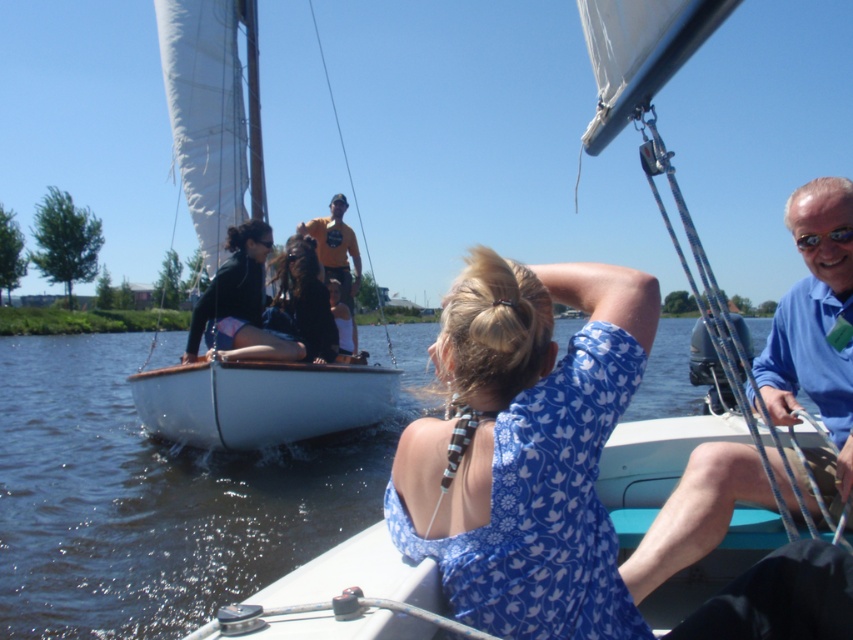
Which is behind, point (314, 275) or point (357, 278)?

Point (357, 278)

Is point (323, 294) positioned before point (320, 232)?

Yes, it is.

Where is `matte black wetsuit at center`? matte black wetsuit at center is located at coordinates [294, 312].

Does blue floral dress at center have a lesser height compared to clear plastic goggles at upper right?

No, blue floral dress at center is not shorter than clear plastic goggles at upper right.

Can you confirm if blue floral dress at center is positioned above clear plastic goggles at upper right?

Actually, blue floral dress at center is below clear plastic goggles at upper right.

Which is behind, point (573, 420) or point (846, 227)?

The point (846, 227) is more distant.

Locate an element on the screen. Image resolution: width=853 pixels, height=640 pixels. blue floral dress at center is located at coordinates (526, 449).

Does clear water at center appear over clear plastic goggles at upper right?

Incorrect, clear water at center is not positioned above clear plastic goggles at upper right.

Between point (167, 339) and point (796, 244), which one is positioned behind?

Point (167, 339)

Is point (86, 412) closer to camera compared to point (830, 232)?

No, it is not.

Where is `clear water at center`? clear water at center is located at coordinates (160, 496).